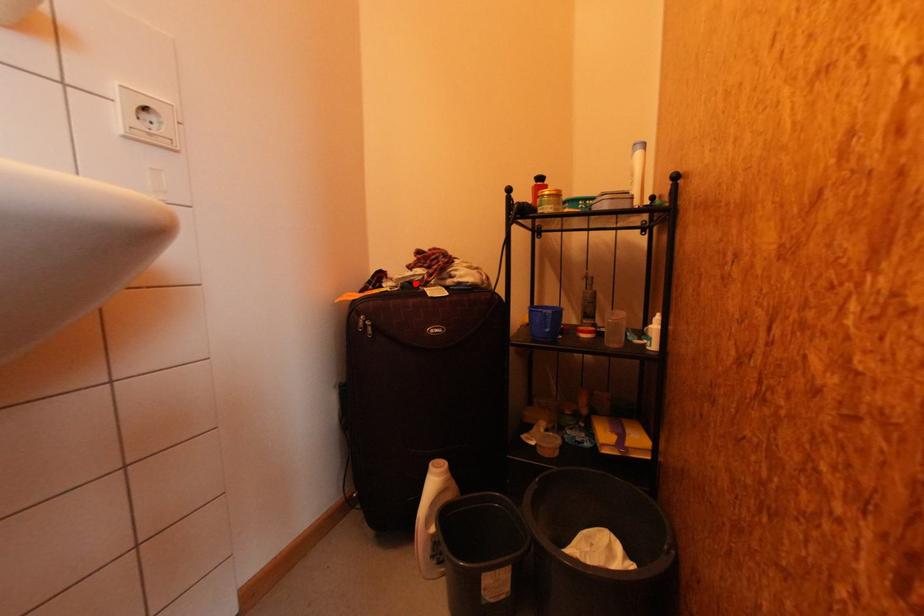
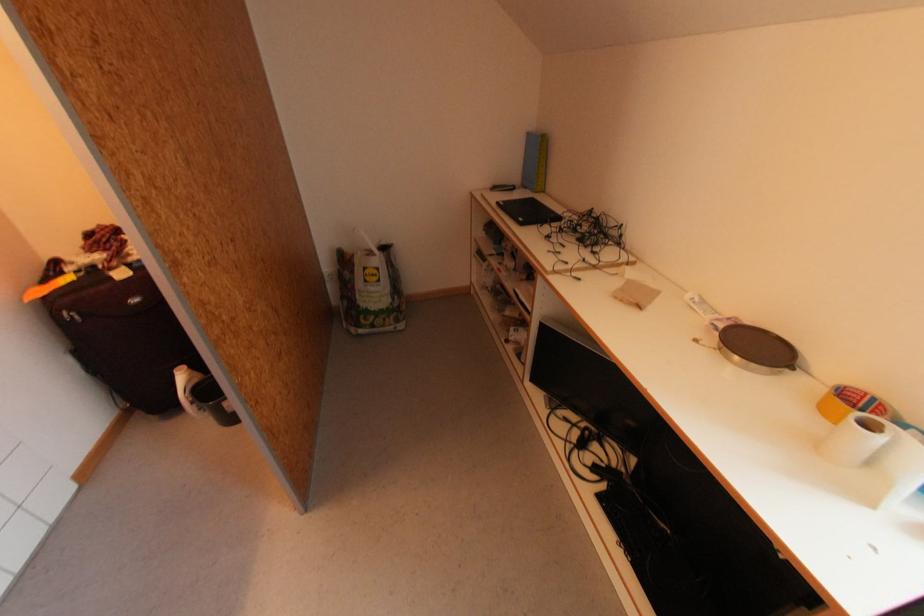
Where in the second image is the point corresponding to the highlighted location from the first image?

(98, 267)